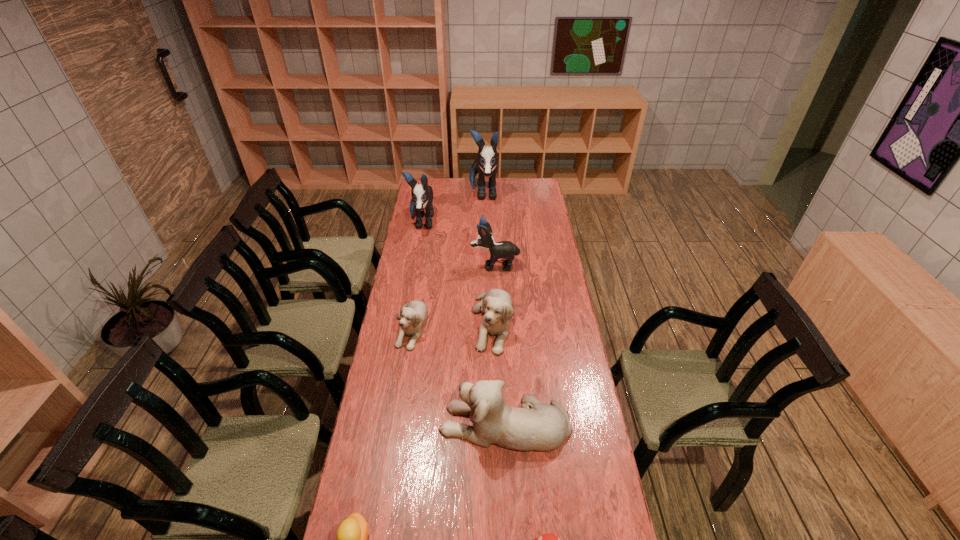
I want to click on vacant space in between the smallest white puppy and the second tallest puppy, so (417, 275).

Find the location of a particular element. The height and width of the screenshot is (540, 960). vacant space that's between the second smallest white puppy and the second smallest black puppy is located at coordinates (457, 273).

At what (x,y) coordinates should I click in order to perform the action: click on free point between the smallest white puppy and the biggest black puppy. Please return your answer as a coordinate pair (x, y). Looking at the image, I should click on (447, 260).

Where is `free point between the second biggest black puppy and the tallest object`? Image resolution: width=960 pixels, height=540 pixels. free point between the second biggest black puppy and the tallest object is located at coordinates (452, 208).

You are a GUI agent. You are given a task and a screenshot of the screen. Output one action in this format:
    pyautogui.click(x=<x>, y=<y>)
    Task: Click on the vacant region between the fifth shortest object and the third shortest object
    
    Given the screenshot: What is the action you would take?
    pyautogui.click(x=458, y=375)

I want to click on vacant point located between the fourth nearest puppy and the shortest puppy, so click(x=453, y=296).

Identify the location of the second closest object to the smallest black puppy. The image size is (960, 540). (422, 195).

Identify which object is the sixth closest to the tallest object. Please provide its 2D coordinates. Your answer should be formatted as a tuple, i.e. [(x, y)], where the tuple contains the x and y coordinates of a point satisfying the conditions above.

[(351, 536)]

Locate which puppy is the third closest to the sixth farthest object. Please provide its 2D coordinates. Your answer should be formatted as a tuple, i.e. [(x, y)], where the tuple contains the x and y coordinates of a point satisfying the conditions above.

[(507, 250)]

Select which puppy is the closest to the fourth tallest object. Please provide its 2D coordinates. Your answer should be formatted as a tuple, i.e. [(x, y)], where the tuple contains the x and y coordinates of a point satisfying the conditions above.

[(496, 304)]